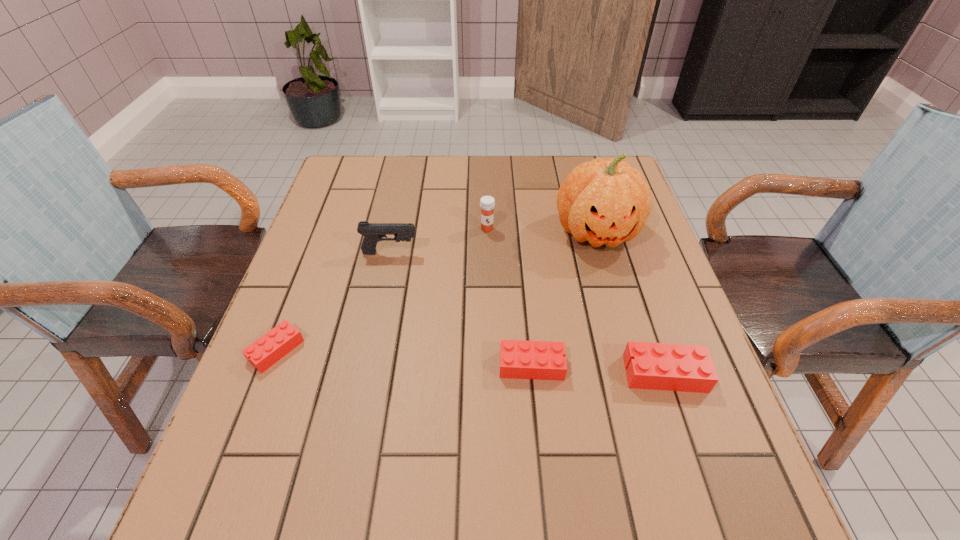
Find the location of `the shortest object`. the shortest object is located at coordinates (263, 353).

The height and width of the screenshot is (540, 960). Identify the location of the leftmost object. (263, 353).

Locate an element on the screen. the second Lego from left to right is located at coordinates (539, 360).

The height and width of the screenshot is (540, 960). Find the location of `the third object from right to left`. the third object from right to left is located at coordinates (539, 360).

I want to click on the rightmost Lego, so click(655, 366).

The width and height of the screenshot is (960, 540). Identify the location of the tallest Lego. (655, 366).

This screenshot has height=540, width=960. I want to click on medicine, so click(487, 203).

You are a GUI agent. You are given a task and a screenshot of the screen. Output one action in this format:
    pyautogui.click(x=<x>, y=<y>)
    Task: Click on the second object from left to right
    
    Given the screenshot: What is the action you would take?
    pyautogui.click(x=373, y=232)

Locate an element on the screen. pumpkin is located at coordinates (608, 202).

The height and width of the screenshot is (540, 960). Identify the location of free space located 0.390m on the right of the shortest Lego. (492, 350).